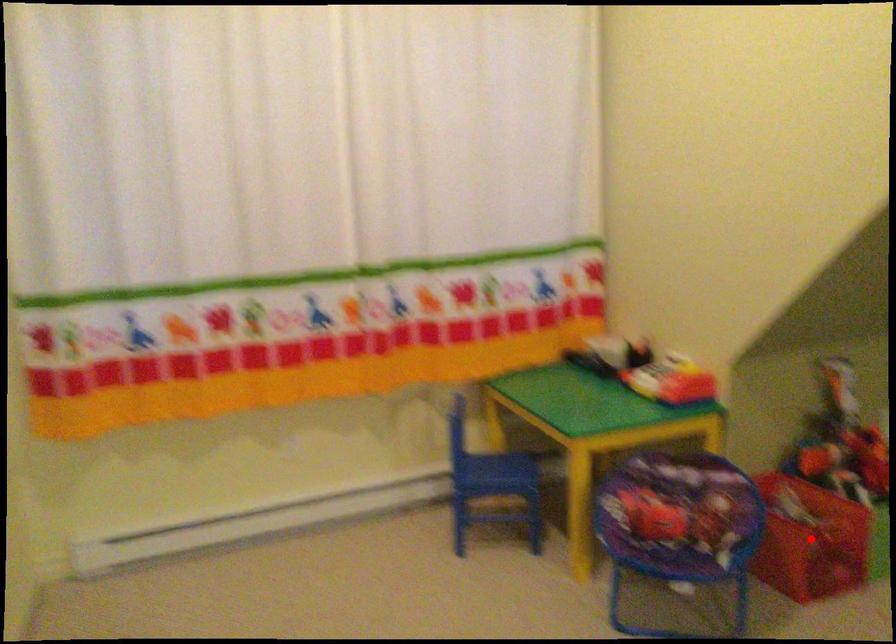
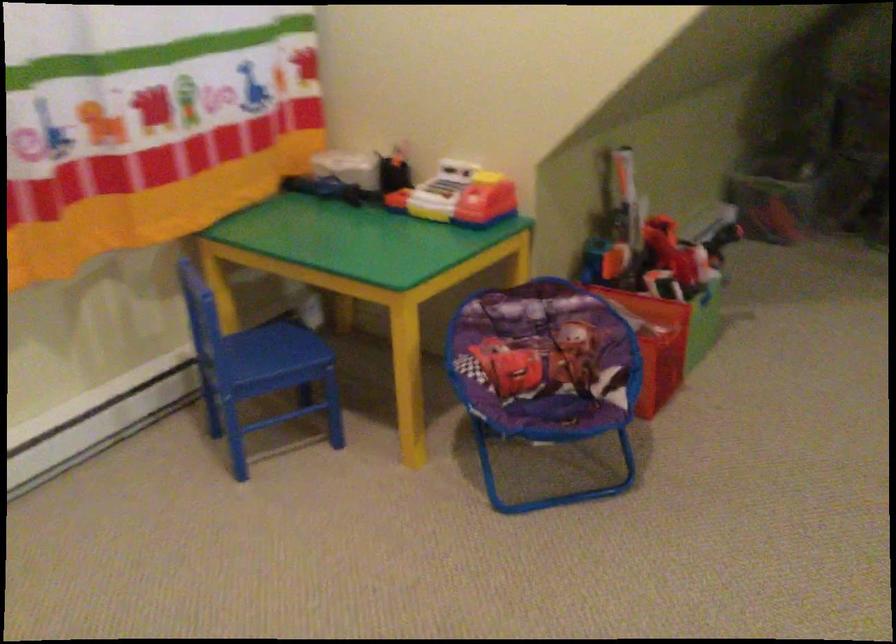
Find the pixel in the second image that matches the highlighted location in the first image.

(653, 343)